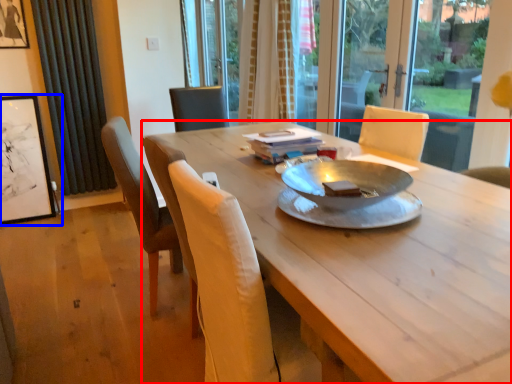
Question: Which of the following is the farthest to the observer, desk (highlighted by a red box) or picture frame (highlighted by a blue box)?

Choices:
 (A) desk
 (B) picture frame

Answer: (B)